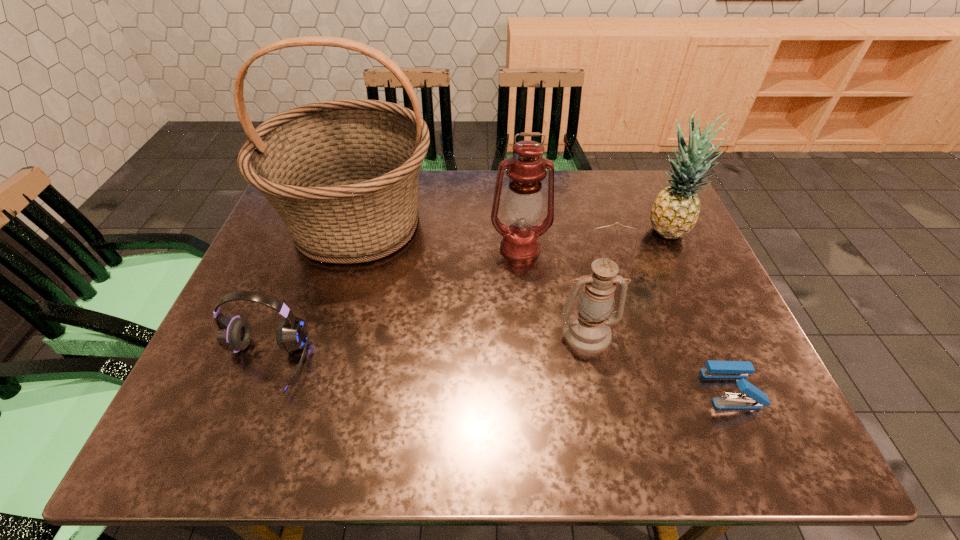
Locate an element on the screen. This screenshot has height=540, width=960. vacant space located 0.050m on the back of the shortest object is located at coordinates (714, 349).

I want to click on object present at the far edge, so click(x=343, y=175).

Find the location of `basket located in the left edge section of the desktop`. basket located in the left edge section of the desktop is located at coordinates coord(343,175).

Locate an element on the screen. headset at the left edge is located at coordinates (234, 334).

What are the coordinates of `pineapple that is at the right edge` in the screenshot? It's located at click(675, 211).

At what (x,y) coordinates should I click in order to perform the action: click on stapler that is at the right edge. Please return your answer as a coordinate pair (x, y). The height and width of the screenshot is (540, 960). Looking at the image, I should click on [753, 398].

Find the location of a particular element. The image size is (960, 540). object at the far left corner is located at coordinates (343, 175).

Find the location of a particular element. The height and width of the screenshot is (540, 960). vacant region at the far edge of the desktop is located at coordinates (455, 183).

Image resolution: width=960 pixels, height=540 pixels. In the image, there is a desktop. Identify the location of free space at the left edge. (292, 239).

At what (x,y) coordinates should I click in order to perform the action: click on free space at the right edge of the desktop. Please return your answer as a coordinate pair (x, y). The width and height of the screenshot is (960, 540). Looking at the image, I should click on (726, 302).